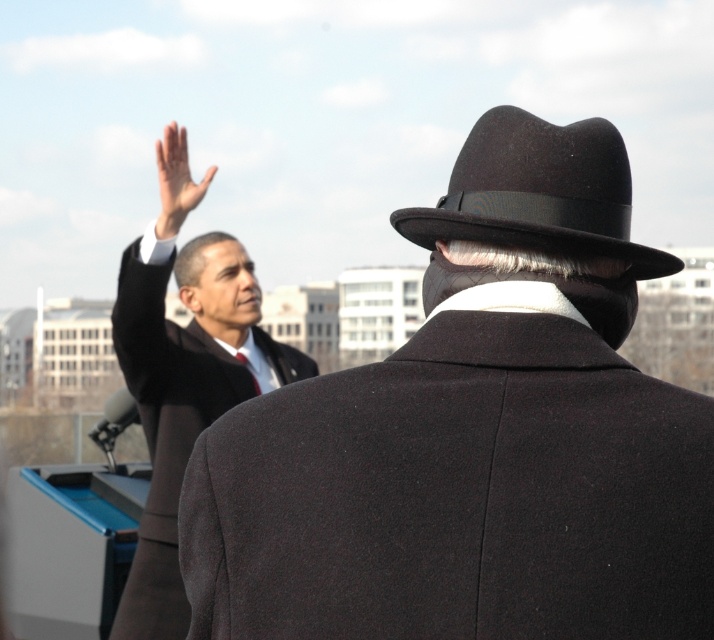
What do you see at coordinates (183, 372) in the screenshot? Image resolution: width=714 pixels, height=640 pixels. I see `matte black suit at upper left` at bounding box center [183, 372].

Who is lower down, matte black suit at upper left or black felt fedora at upper right?

Positioned lower is matte black suit at upper left.

Locate an element on the screen. This screenshot has height=640, width=714. matte black suit at upper left is located at coordinates (183, 372).

Where is `matte black suit at upper left`? matte black suit at upper left is located at coordinates (183, 372).

Can you confirm if black felt fedora at upper right is smaller than matte black hand at upper left?

No, black felt fedora at upper right is not smaller than matte black hand at upper left.

Consider the image. Between black felt fedora at upper right and matte black hand at upper left, which one appears on the right side from the viewer's perspective?

black felt fedora at upper right is more to the right.

In order to click on black felt fedora at upper right in this screenshot , I will do `click(538, 193)`.

The image size is (714, 640). I want to click on black felt fedora at upper right, so click(x=538, y=193).

Is matte black suit at upper left thinner than matte black hand at upper left?

Incorrect, matte black suit at upper left's width is not less than matte black hand at upper left's.

The image size is (714, 640). What do you see at coordinates (183, 372) in the screenshot? I see `matte black suit at upper left` at bounding box center [183, 372].

You are a GUI agent. You are given a task and a screenshot of the screen. Output one action in this format:
    pyautogui.click(x=<x>, y=<y>)
    Task: Click on the matte black suit at upper left
    Image resolution: width=714 pixels, height=640 pixels.
    Given the screenshot: What is the action you would take?
    pyautogui.click(x=183, y=372)